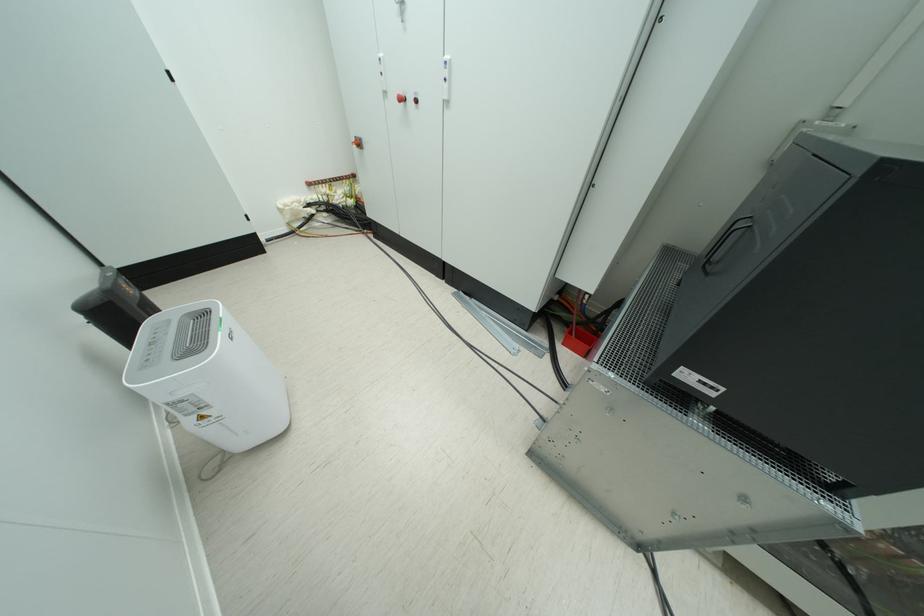
The height and width of the screenshot is (616, 924). I want to click on red emergency button, so click(x=416, y=98).